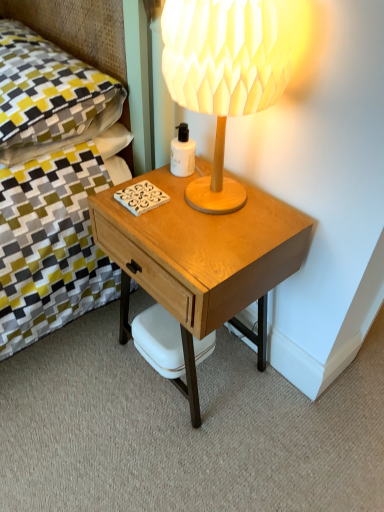
Question: Can you confirm if wooden lampshade at upper right is wider than light brown wood desk at center?

Choices:
 (A) no
 (B) yes

Answer: (A)

Question: Is wooden lampshade at upper right not near light brown wood desk at center?

Choices:
 (A) no
 (B) yes

Answer: (A)

Question: Is wooden lampshade at upper right positioned before light brown wood desk at center?

Choices:
 (A) yes
 (B) no

Answer: (A)

Question: From the image's perspective, is wooden lampshade at upper right located beneath light brown wood desk at center?

Choices:
 (A) yes
 (B) no

Answer: (B)

Question: Considering the relative sizes of wooden lampshade at upper right and light brown wood desk at center in the image provided, is wooden lampshade at upper right bigger than light brown wood desk at center?

Choices:
 (A) yes
 (B) no

Answer: (B)

Question: Does wooden lampshade at upper right have a lesser height compared to light brown wood desk at center?

Choices:
 (A) yes
 (B) no

Answer: (A)

Question: From a real-world perspective, does white matte bottle at center sit lower than light brown wood desk at center?

Choices:
 (A) no
 (B) yes

Answer: (A)

Question: From the image's perspective, is white matte bottle at center on light brown wood desk at center?

Choices:
 (A) yes
 (B) no

Answer: (A)

Question: Are white matte bottle at center and light brown wood desk at center located far from each other?

Choices:
 (A) yes
 (B) no

Answer: (B)

Question: Is white matte bottle at center at the right side of light brown wood desk at center?

Choices:
 (A) yes
 (B) no

Answer: (B)

Question: Is white matte bottle at center facing towards light brown wood desk at center?

Choices:
 (A) yes
 (B) no

Answer: (B)

Question: Can you confirm if white matte bottle at center is shorter than light brown wood desk at center?

Choices:
 (A) no
 (B) yes

Answer: (B)

Question: Would you say white matte bottle at center is outside white matte coffee cup at lower center?

Choices:
 (A) yes
 (B) no

Answer: (A)